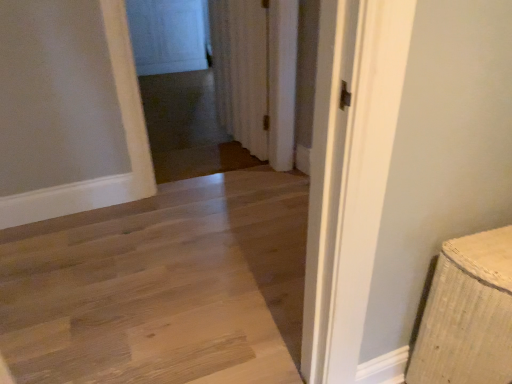
Question: Does natural wood floor at center have a smaller size compared to transparent glass screen door at upper center?

Choices:
 (A) no
 (B) yes

Answer: (A)

Question: Is natural wood floor at center in front of transparent glass screen door at upper center?

Choices:
 (A) yes
 (B) no

Answer: (A)

Question: Does natural wood floor at center have a greater height compared to transparent glass screen door at upper center?

Choices:
 (A) no
 (B) yes

Answer: (A)

Question: Considering the relative sizes of natural wood floor at center and transparent glass screen door at upper center in the image provided, is natural wood floor at center wider than transparent glass screen door at upper center?

Choices:
 (A) yes
 (B) no

Answer: (A)

Question: Does natural wood floor at center touch transparent glass screen door at upper center?

Choices:
 (A) yes
 (B) no

Answer: (B)

Question: Considering the positions of white textured curtain at center and transparent glass screen door at upper center in the image, is white textured curtain at center bigger or smaller than transparent glass screen door at upper center?

Choices:
 (A) big
 (B) small

Answer: (A)

Question: Considering the relative positions of white textured curtain at center and transparent glass screen door at upper center in the image provided, is white textured curtain at center to the left or to the right of transparent glass screen door at upper center?

Choices:
 (A) left
 (B) right

Answer: (B)

Question: Considering the positions of point (286, 56) and point (164, 69), is point (286, 56) closer or farther from the camera than point (164, 69)?

Choices:
 (A) farther
 (B) closer

Answer: (B)

Question: Relative to transparent glass screen door at upper center, is white textured curtain at center in front or behind?

Choices:
 (A) front
 (B) behind

Answer: (A)

Question: From a real-world perspective, is transparent glass screen door at upper center physically located above or below natural wood floor at center?

Choices:
 (A) below
 (B) above

Answer: (B)

Question: From the image's perspective, is transparent glass screen door at upper center above or below natural wood floor at center?

Choices:
 (A) above
 (B) below

Answer: (A)

Question: Does point 193,46 appear closer or farther from the camera than point 180,264?

Choices:
 (A) closer
 (B) farther

Answer: (B)

Question: Based on their sizes in the image, would you say transparent glass screen door at upper center is bigger or smaller than natural wood floor at center?

Choices:
 (A) small
 (B) big

Answer: (A)

Question: Choose the correct answer: Is natural wood floor at center inside white textured curtain at center or outside it?

Choices:
 (A) inside
 (B) outside

Answer: (B)

Question: Considering the positions of natural wood floor at center and white textured curtain at center in the image, is natural wood floor at center bigger or smaller than white textured curtain at center?

Choices:
 (A) big
 (B) small

Answer: (A)